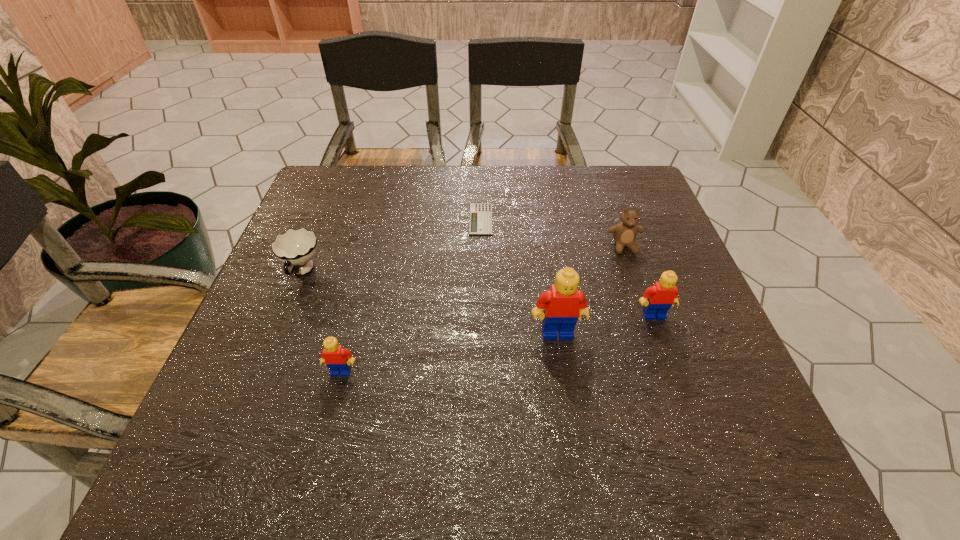
To achieve even spacing by inserting another Lego among them, please point to a vacant spot for this new Lego. Please provide its 2D coordinates. Your answer should be formatted as a tuple, i.e. [(x, y)], where the tuple contains the x and y coordinates of a point satisfying the conditions above.

[(453, 352)]